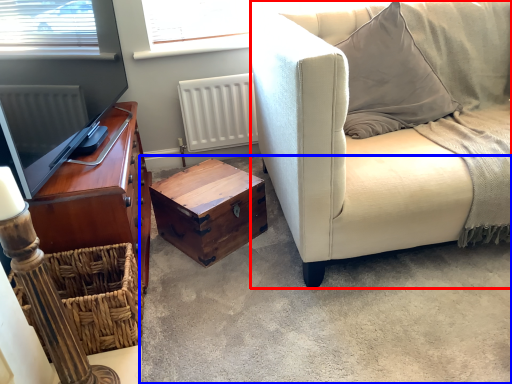
Question: Which object appears farthest to the camera in this image, studio couch (highlighted by a red box) or concrete (highlighted by a blue box)?

Choices:
 (A) studio couch
 (B) concrete

Answer: (A)